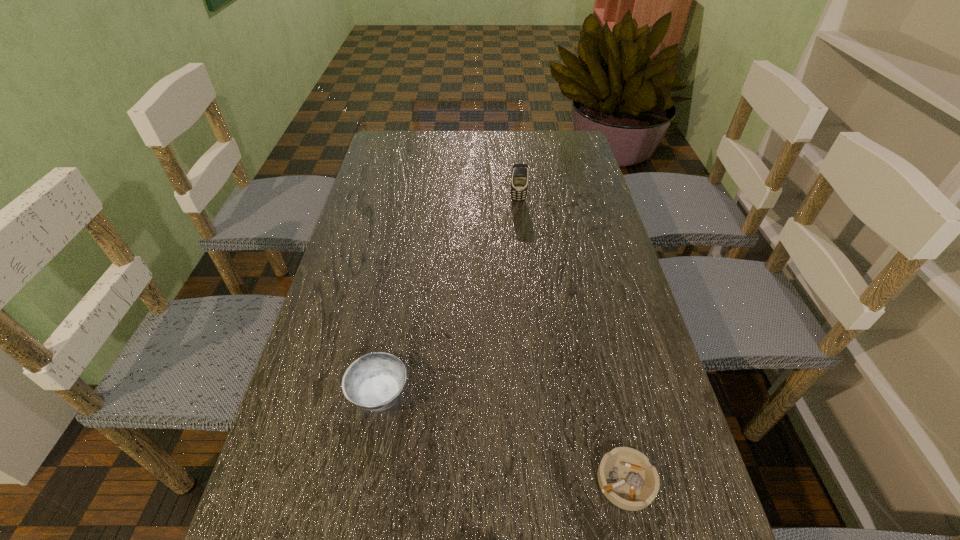
The image size is (960, 540). Identify the location of the tallest object. (520, 172).

I want to click on the farthest object, so pyautogui.click(x=520, y=172).

In order to click on the second tallest object in this screenshot , I will do `click(374, 382)`.

The image size is (960, 540). I want to click on the second nearest object, so click(374, 382).

This screenshot has height=540, width=960. What are the coordinates of `the shorter ashtray` in the screenshot? It's located at (627, 479).

Where is `the nearer ashtray`? This screenshot has width=960, height=540. the nearer ashtray is located at coordinates (627, 479).

Locate an element on the screen. The image size is (960, 540). blank space located 0.270m on the front face of the second object from right to left is located at coordinates (525, 262).

You are a GUI agent. You are given a task and a screenshot of the screen. Output one action in this format:
    pyautogui.click(x=<x>, y=<y>)
    Task: Click on the vacant position located on the front of the leftmost object
    Image resolution: width=960 pixels, height=540 pixels.
    Given the screenshot: What is the action you would take?
    pyautogui.click(x=363, y=482)

Identify the location of vacant space located on the back of the right ashtray. The image size is (960, 540). (595, 346).

Find the location of a particular element. This screenshot has width=960, height=540. object that is at the left edge is located at coordinates (374, 382).